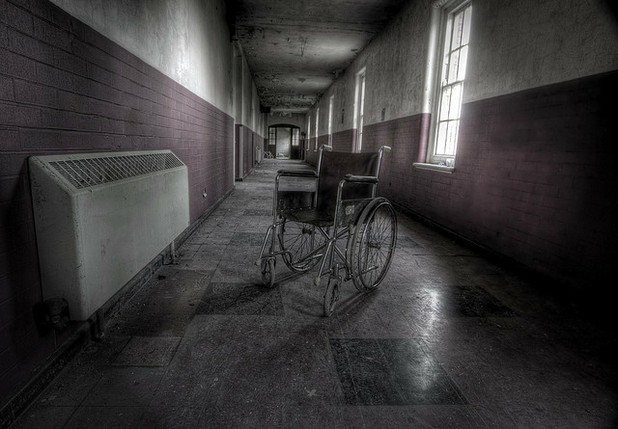
Image resolution: width=618 pixels, height=429 pixels. In order to click on radiator in this screenshot , I will do `click(122, 229)`.